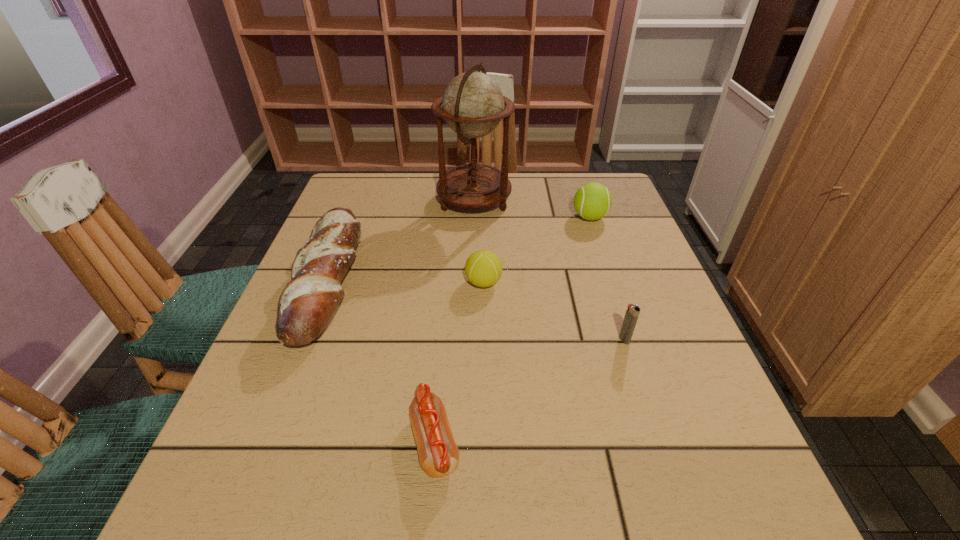
At what (x,y) coordinates should I click in order to perform the action: click on globe. Please return your answer as a coordinate pair (x, y). The image size is (960, 540). Looking at the image, I should click on (472, 104).

Identify the location of the farther tennis ball. Image resolution: width=960 pixels, height=540 pixels. (592, 201).

I want to click on the taller tennis ball, so click(x=592, y=201).

Locate an element on the screen. This screenshot has width=960, height=540. the leftmost object is located at coordinates (307, 303).

Locate an element on the screen. The image size is (960, 540). igniter is located at coordinates click(632, 313).

Where is `the shorter tennis ball`? the shorter tennis ball is located at coordinates (483, 268).

Where is `the nearer tennis ball`? the nearer tennis ball is located at coordinates (483, 268).

Where is `the nearest object`? This screenshot has height=540, width=960. the nearest object is located at coordinates pos(438,453).

At what (x,y) coordinates should I click in order to perform the action: click on the shortest object. Please return your answer as a coordinate pair (x, y). Looking at the image, I should click on (438, 453).

What are the coordinates of `blank space located on the surface of the tallest object` in the screenshot? It's located at (605, 201).